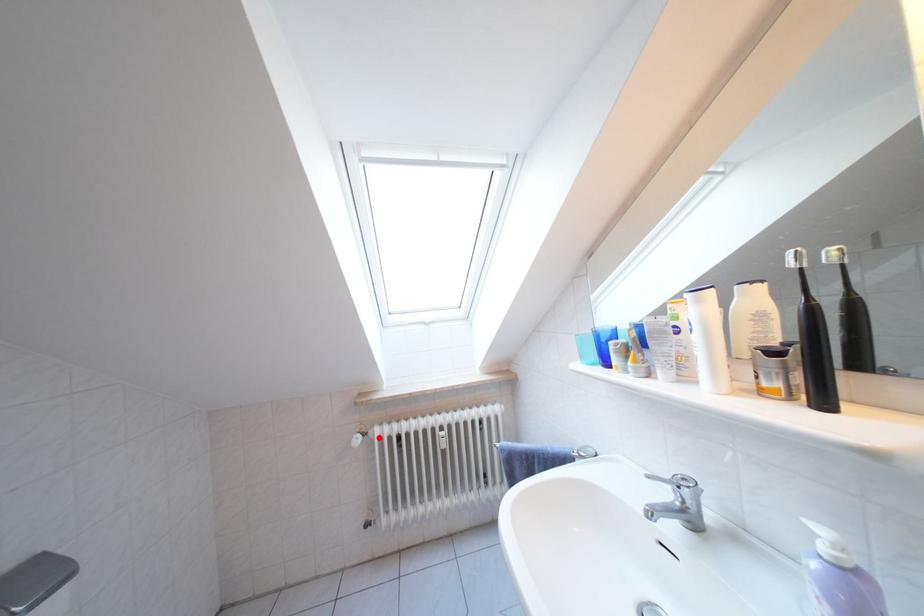
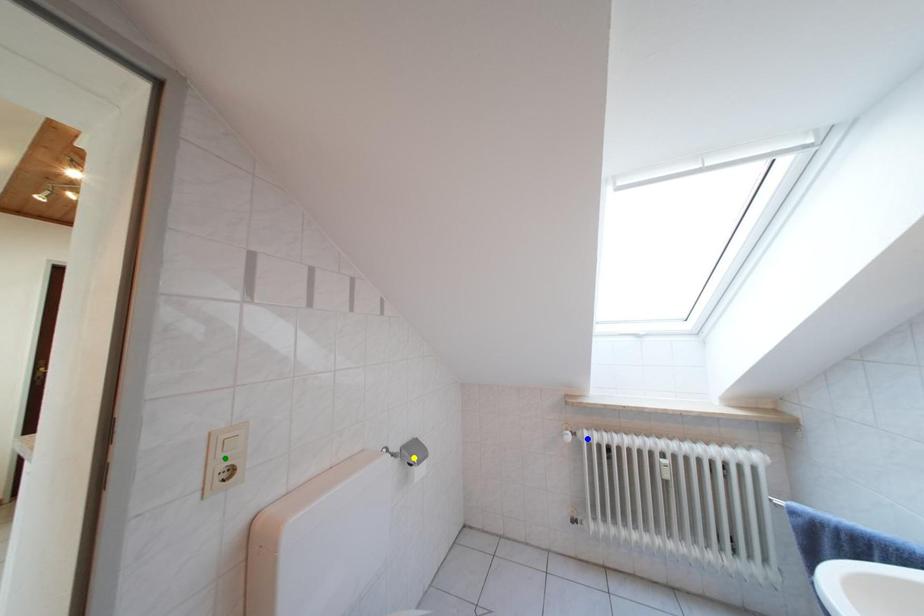
Question: I am providing you with two images of the same scene from different viewpoints. A red point is marked on the first image. You are given multiple points on the second image. In image 2, which mark is for the same physical point as the one in image 1?

Choices:
 (A) blue point
 (B) green point
 (C) yellow point

Answer: (A)